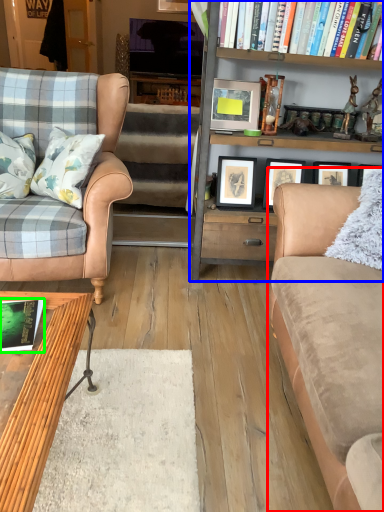
Question: Which object is positioned farthest from studio couch (highlighted by a red box)? Select from bookcase (highlighted by a blue box) and book (highlighted by a green box).

Choices:
 (A) bookcase
 (B) book

Answer: (B)